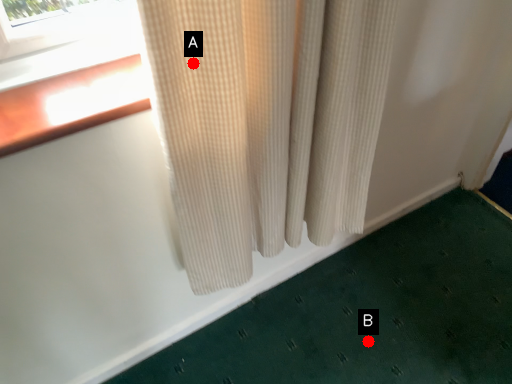
Question: Two points are circled on the image, labeled by A and B beside each circle. Which point is further to the camera?

Choices:
 (A) A is further
 (B) B is further

Answer: (B)